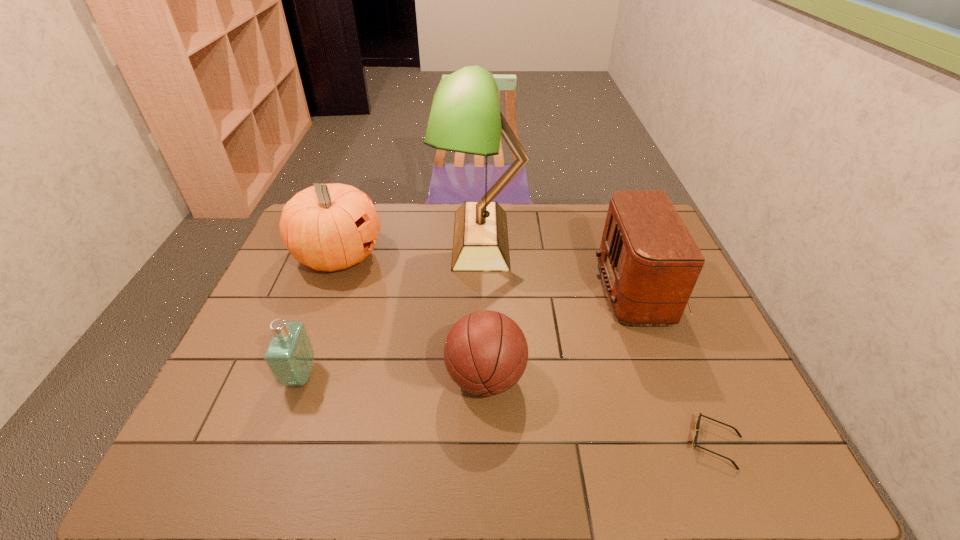
At what (x,y) coordinates should I click in order to perform the action: click on vacant space located 0.140m on the front-facing side of the pumpkin. Please return your answer as a coordinate pair (x, y). The image size is (960, 540). Looking at the image, I should click on (426, 255).

Locate an element on the screen. Image resolution: width=960 pixels, height=540 pixels. vacant space located on the front panel of the radio receiver is located at coordinates (556, 290).

Identify the location of vacant region located on the front panel of the radio receiver. Image resolution: width=960 pixels, height=540 pixels. (556, 290).

I want to click on free space located on the front panel of the radio receiver, so click(x=503, y=290).

Identify the location of vacant space located 0.310m on the right of the basketball. (651, 377).

I want to click on free space located on the front label of the perfume, so click(x=374, y=376).

This screenshot has height=540, width=960. Find the location of `vacant region located 0.110m on the lenses of the shortest object`. vacant region located 0.110m on the lenses of the shortest object is located at coordinates (637, 444).

Find the location of a particular element. The height and width of the screenshot is (540, 960). free spot located on the lenses of the shortest object is located at coordinates (633, 444).

This screenshot has width=960, height=540. Identify the location of vacant region located 0.220m on the lenses of the shortest object. (587, 444).

Locate an element on the screen. Image resolution: width=960 pixels, height=540 pixels. table lamp located at the far edge is located at coordinates (465, 116).